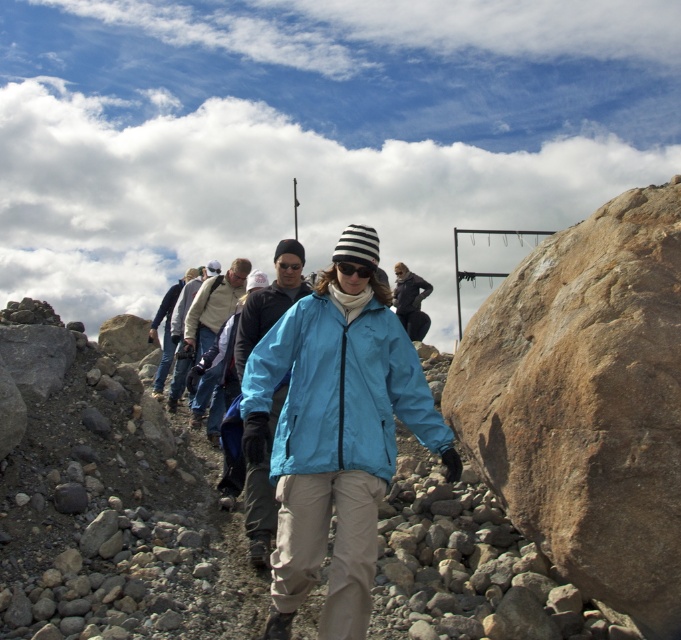
Which is in front, point (255, 314) or point (221, 314)?

Point (255, 314) is more forward.

Who is shorter, light blue fabric jacket at center or light gray fleece jacket at center?

Standing shorter between the two is light blue fabric jacket at center.

Who is more forward, (237,358) or (210,284)?

Positioned in front is point (237,358).

Image resolution: width=681 pixels, height=640 pixels. In order to click on light blue fabric jacket at center in this screenshot , I will do `click(262, 317)`.

Which is in front, point (255, 380) or point (405, 282)?

Point (255, 380) is in front.

Based on the photo, can you confirm if matte blue jacket at center is positioned below dark blue fabric jacket at center?

Yes.

Locate an element on the screen. matte blue jacket at center is located at coordinates (272, 352).

Between point (396, 291) and point (426, 289), which one is positioned in front?

Point (396, 291)

Is dark blue fabric jacket at center smaller than blue fabric jacket at center?

Incorrect, dark blue fabric jacket at center is not smaller in size than blue fabric jacket at center.

Locate an element on the screen. Image resolution: width=681 pixels, height=640 pixels. dark blue fabric jacket at center is located at coordinates coord(411,301).